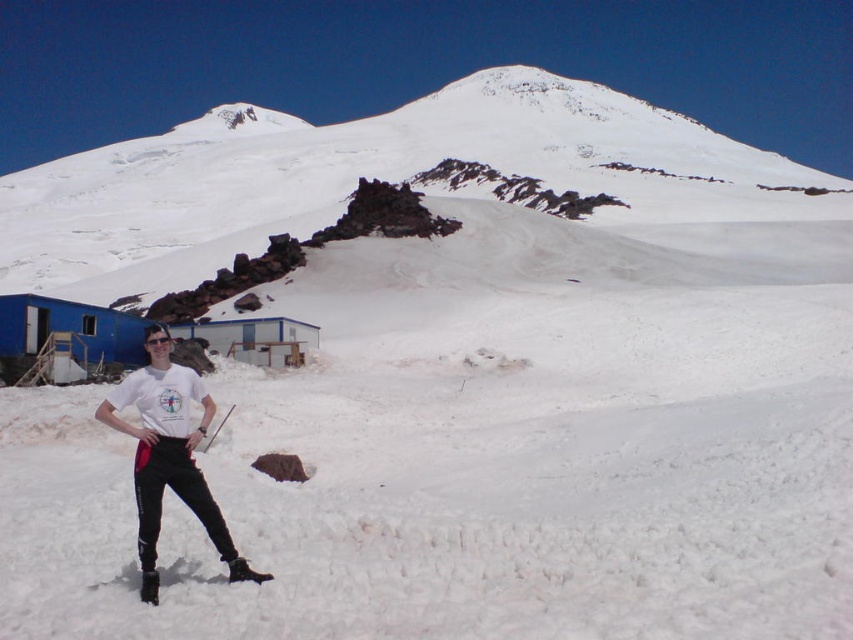
Question: Does snowy white mountain at upper center have a smaller size compared to white matte t-shirt at lower left?

Choices:
 (A) no
 (B) yes

Answer: (A)

Question: Which of the following is the farthest from the observer?

Choices:
 (A) (200, 243)
 (B) (138, 470)

Answer: (A)

Question: Can you confirm if snowy white mountain at upper center is wider than white matte t-shirt at lower left?

Choices:
 (A) no
 (B) yes

Answer: (B)

Question: Can you confirm if snowy white mountain at upper center is smaller than white matte t-shirt at lower left?

Choices:
 (A) no
 (B) yes

Answer: (A)

Question: Which point is closer to the camera?

Choices:
 (A) (277, 221)
 (B) (154, 416)

Answer: (B)